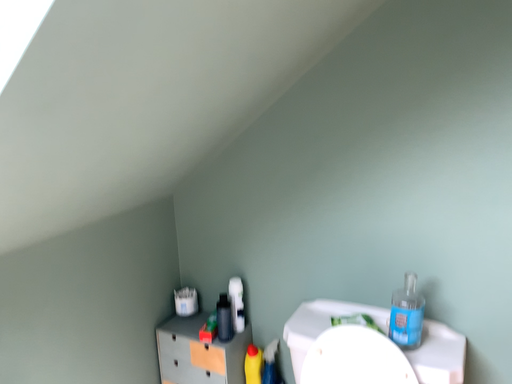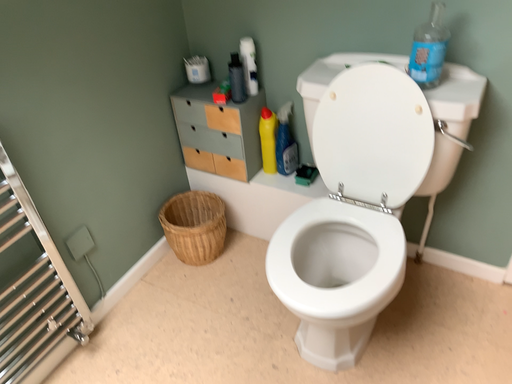
Question: How did the camera likely rotate when shooting the video?

Choices:
 (A) rotated upward
 (B) rotated downward

Answer: (B)